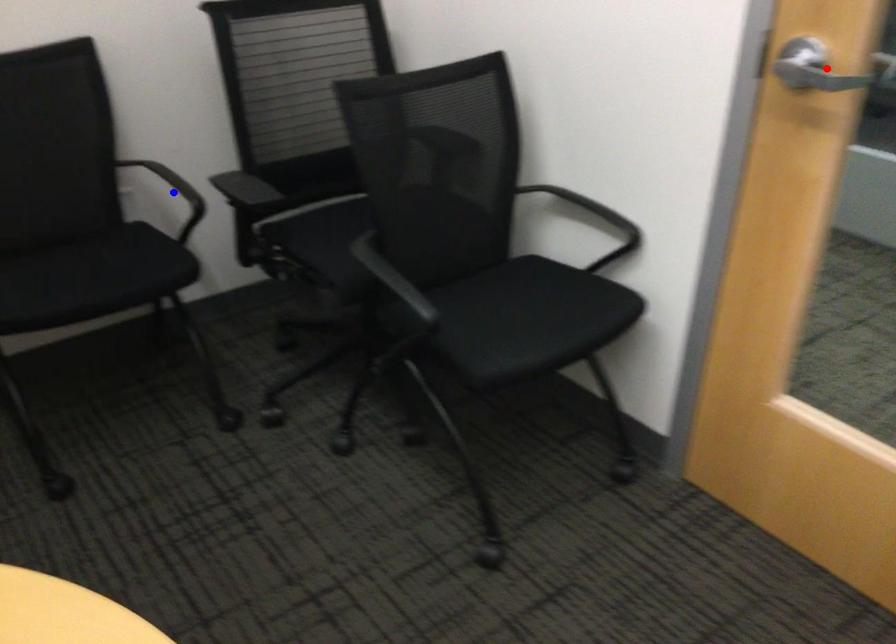
Question: In the image, two points are highlighted. Which point is nearer to the camera? Reply with the corresponding letter.

Choices:
 (A) blue point
 (B) red point

Answer: (B)